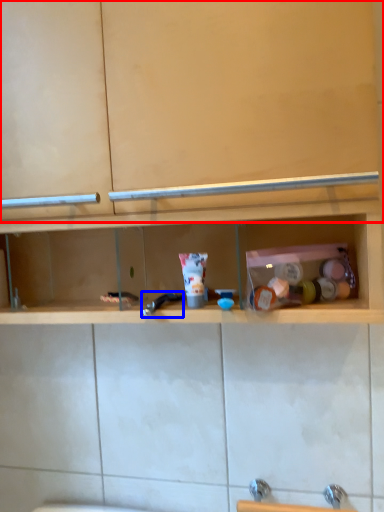
Question: Which object appears farthest to the camera in this image, cabinet (highlighted by a red box) or faucet (highlighted by a blue box)?

Choices:
 (A) cabinet
 (B) faucet

Answer: (B)